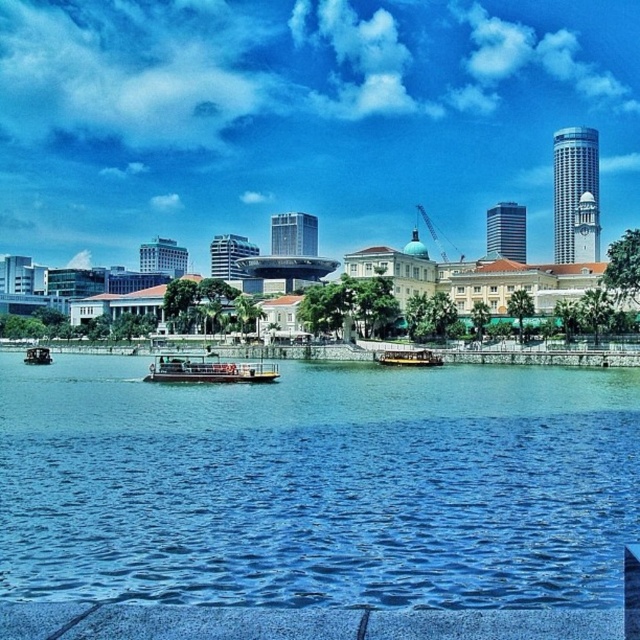
You are a delivery drone that needs to fly between the yellow matte boat at center and the wooden boat at center. What is the minimum distance you must cover to travel between them?

The minimum distance you must cover to travel between the yellow matte boat at center and the wooden boat at center is 29.87 meters.

You are standing on the dock and see the blue water at center and the wooden polished boat at center. Which object is positioned lower in the scene?

The blue water at center is positioned below the wooden polished boat at center, so it is lower in the scene.

You are standing on the dock and see the blue water at center and the yellow matte boat at center. Which object is positioned lower in the scene?

The blue water at center is located below the yellow matte boat at center, so it is positioned lower in the scene.